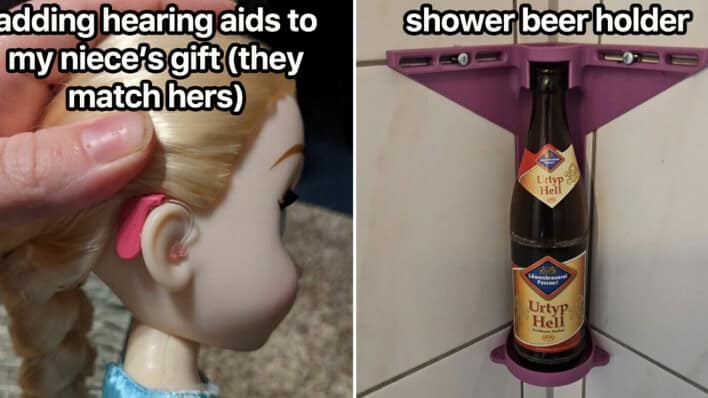
I want to click on screws, so click(x=627, y=60), click(x=462, y=60).